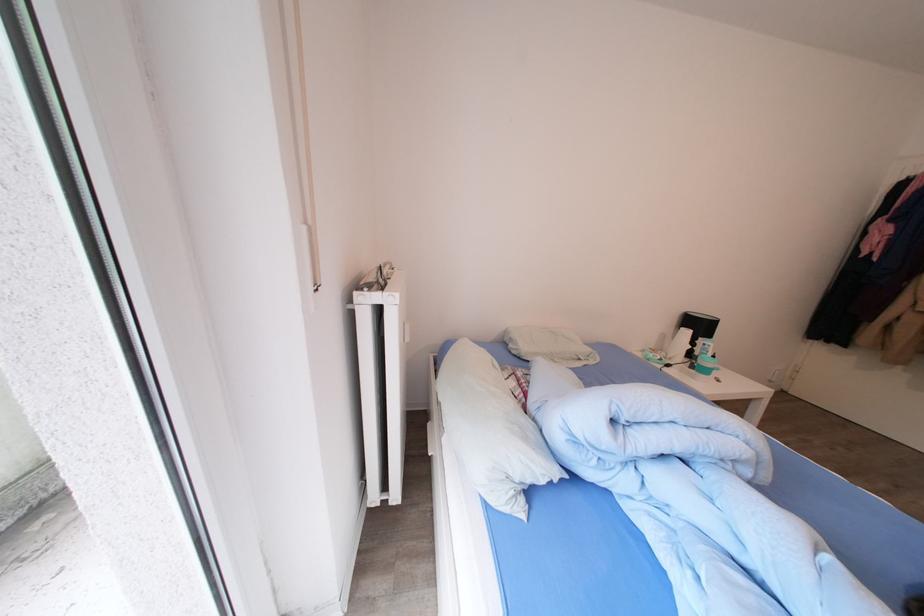
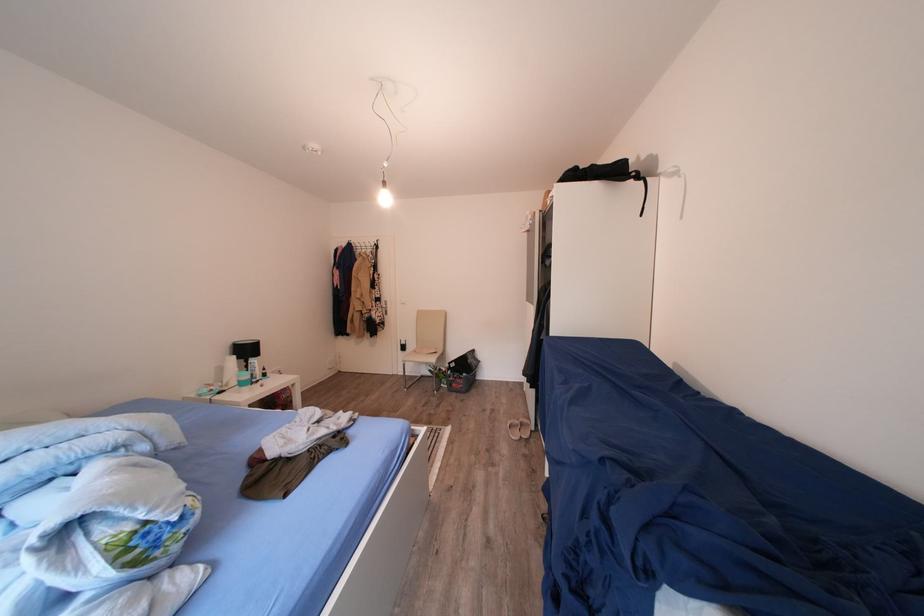
In the second image, find the point that corresponds to pixel 708 331 in the first image.

(256, 355)